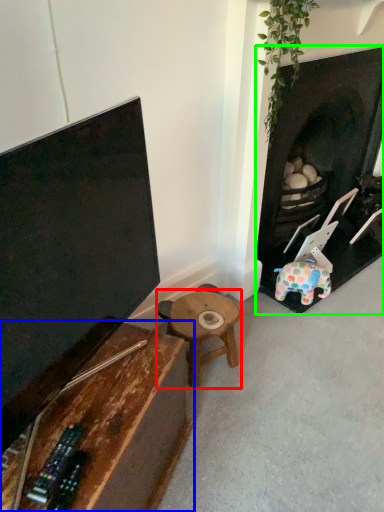
Question: Which object is positioned farthest from table (highlighted by a red box)? Select from table (highlighted by a blue box) and fireplace (highlighted by a green box).

Choices:
 (A) table
 (B) fireplace

Answer: (B)